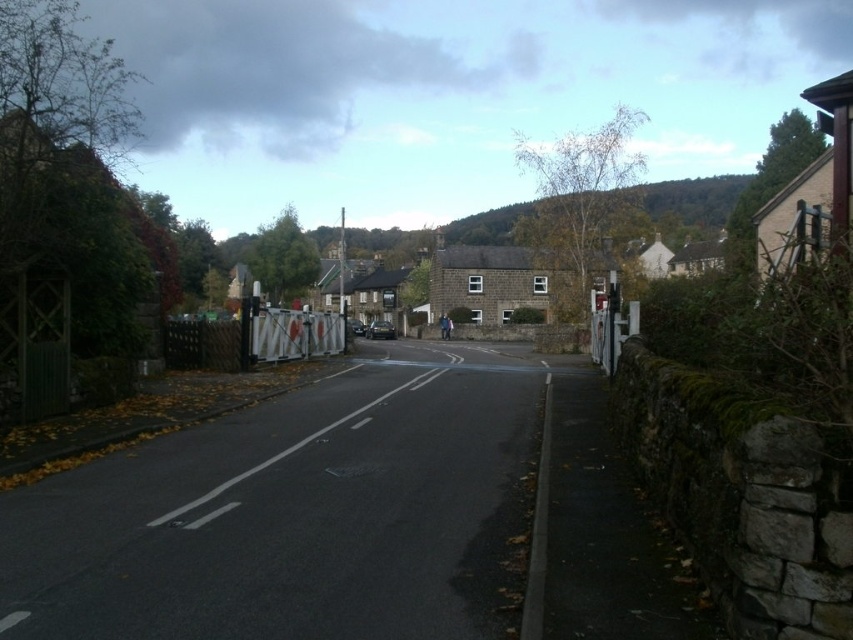
You are a delivery driver who needs to park your truck near the brown stone house at center without blocking the white plastic barrier at center. Given that your truck is 60 feet long, is there enough space between them to park safely?

The distance between the brown stone house at center and the white plastic barrier at center is 81.83 feet. Since your truck is 60 feet long, there is sufficient space to park safely without blocking the barrier.

You are a delivery driver approaching the road with a truck that is 2 meters wide. You need to pass through the area between the white plastic barrier at center and the stone house at center. Can your truck fit through the space between them?

The white plastic barrier at center has a lesser width compared to the stone house at center, but the description does not provide the exact width of the space between them. Therefore, it is unclear if the truck can fit through the space between them.